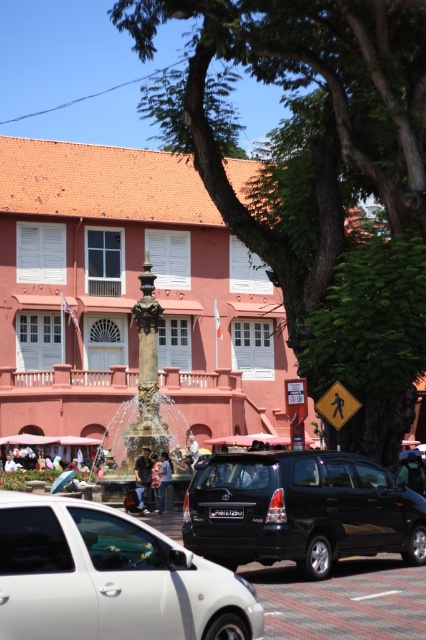
From the picture: You are a delivery driver trying to park your black matte suv at center in a parking spot near the bronze ornate fountain at center. The parking spot has a height restriction of 1.8 meters. Can your suv fit under the height restriction if the fountain is 2 meters tall?

The bronze ornate fountain at center is 2 meters tall, and the black matte suv at center is not as tall as the bronze ornate fountain at center. Since the suv is shorter than the fountain, it should be able to fit under the 1.8 meter height restriction.